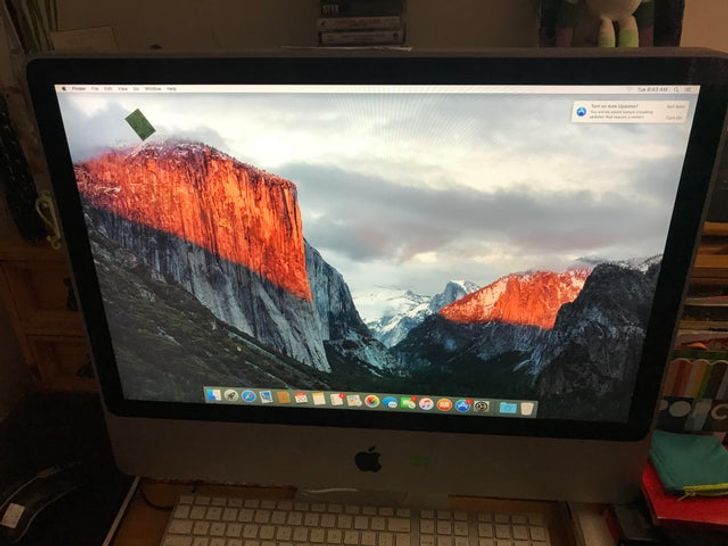
You are a GUI agent. You are given a task and a screenshot of the screen. Output one action in this format:
    pyautogui.click(x=<x>, y=<y>)
    Task: Click on the keyboard
    
    Given the screenshot: What is the action you would take?
    pyautogui.click(x=245, y=503)